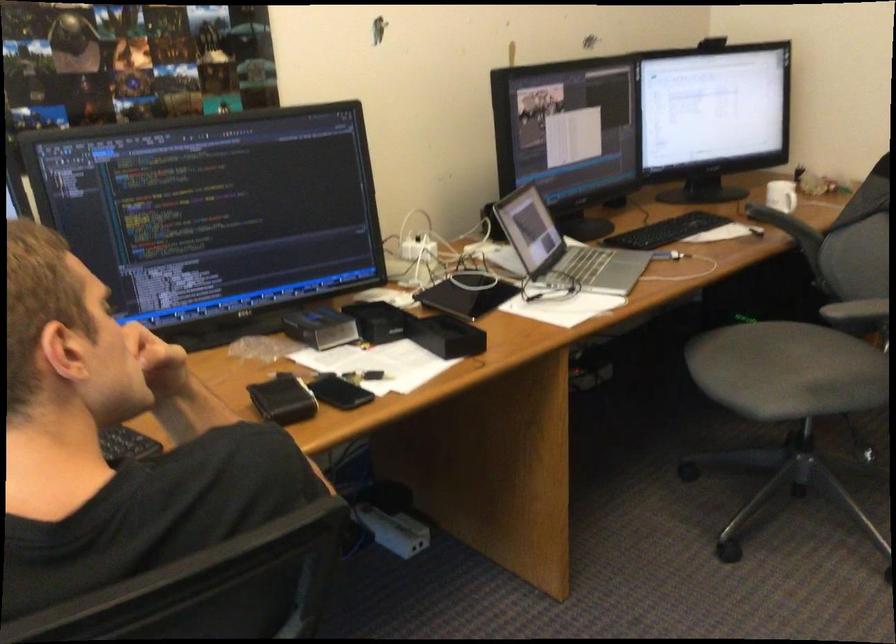
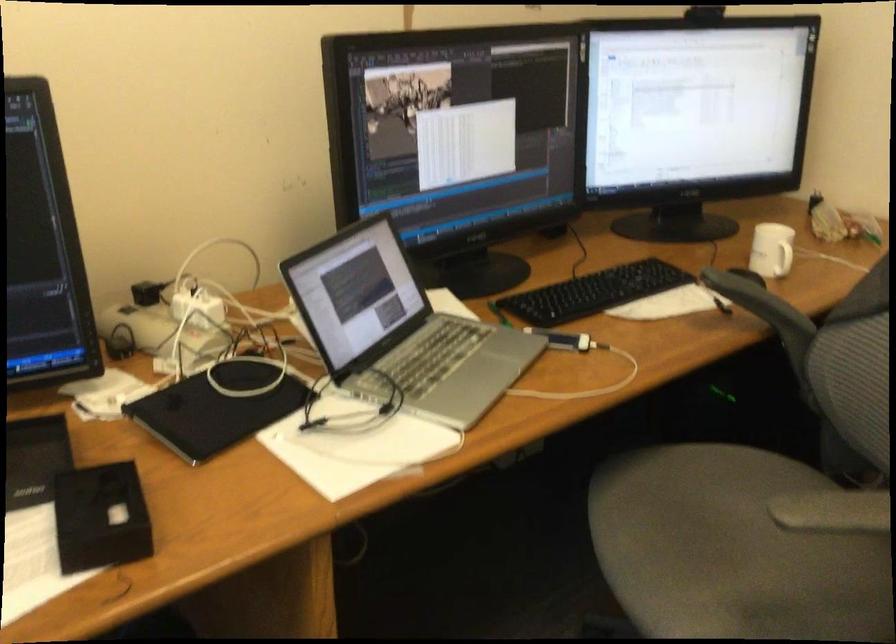
Locate, in the second image, the point that corresponds to point 793,200 in the first image.

(782, 259)